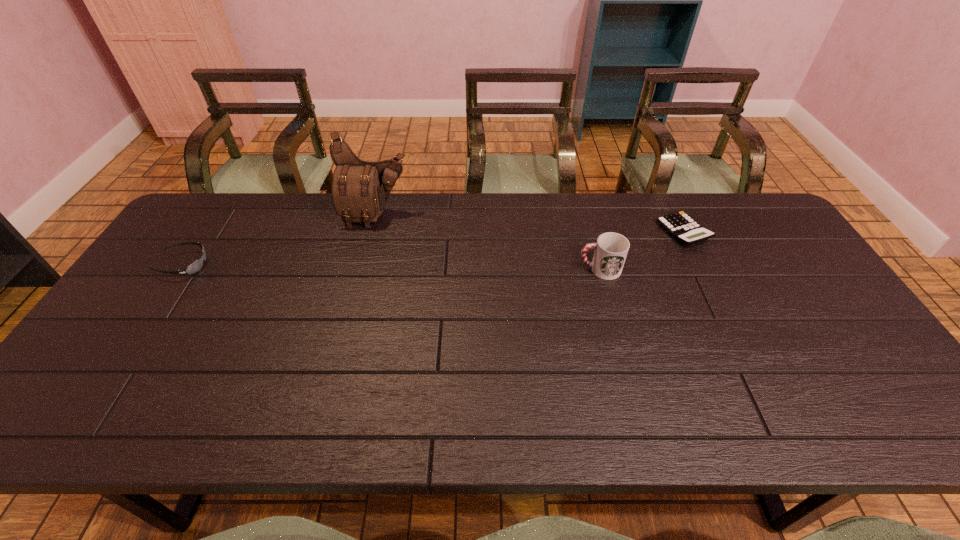
I want to click on free space at the right edge of the desktop, so click(x=773, y=298).

Find the location of a particular element. The width and height of the screenshot is (960, 540). vacant region at the far left corner of the desktop is located at coordinates (223, 206).

Find the location of a particular element. blank region between the third object from left to right and the leftmost object is located at coordinates (392, 267).

Identify the location of free space that is in between the third tallest object and the third shortest object. The height and width of the screenshot is (540, 960). (392, 267).

Where is `free space between the second object from right to left and the shortest object`? free space between the second object from right to left and the shortest object is located at coordinates (641, 251).

At what (x,y) coordinates should I click in order to perform the action: click on empty space that is in between the shoulder bag and the third tallest object. Please return your answer as a coordinate pair (x, y). Looking at the image, I should click on (280, 240).

The image size is (960, 540). Find the location of `vacant area that lies between the rightmost object and the shoulder bag`. vacant area that lies between the rightmost object and the shoulder bag is located at coordinates (529, 224).

Where is `vacant area that lies between the rightmost object and the leftmost object`? This screenshot has width=960, height=540. vacant area that lies between the rightmost object and the leftmost object is located at coordinates (434, 248).

The height and width of the screenshot is (540, 960). I want to click on empty space between the second tallest object and the tallest object, so point(488,242).

The image size is (960, 540). Identify the location of free space between the third shortest object and the third tallest object. (392, 267).